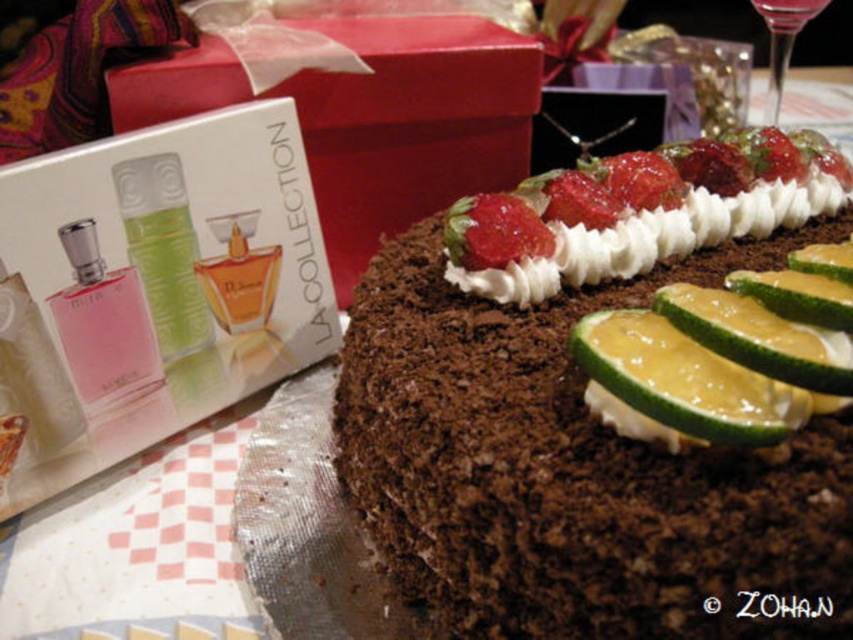
You are a guest at a party and want to grab a drink from the transparent glass at upper right. However, there is a yellow smooth lemon at center in the way. Can you reach the glass without moving the lemon?

The yellow smooth lemon at center is in front of the transparent glass at upper right, so you can reach the glass by moving around the lemon to access it from the side or behind.

In the scene shown: You are a chef preparing a dessert display. You have a chocolatecrumblycake at right and a yellow smooth lemon at center. Which of these two items is taller?

The chocolatecrumblycake at right is taller than the yellow smooth lemon at center.

You are at a party and want to grab a drink. There is a yellow smooth lemon at center and a transparent glass at upper right. Which one should you pick up first to pour the lemon into the glass?

You should pick up the transparent glass at upper right first because the yellow smooth lemon at center is to the left of it, so you need to move the glass to the left to pour the lemon into it.